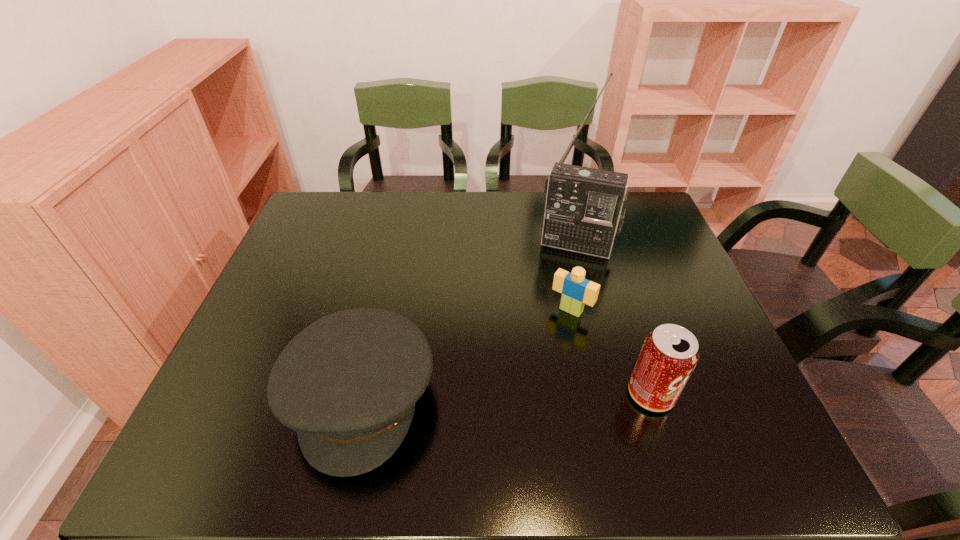
The width and height of the screenshot is (960, 540). Find the location of `beret`. beret is located at coordinates (348, 383).

Image resolution: width=960 pixels, height=540 pixels. Find the location of `the second tallest object`. the second tallest object is located at coordinates (669, 354).

The width and height of the screenshot is (960, 540). Find the location of `radio receiver`. radio receiver is located at coordinates (585, 207).

You are a GUI agent. You are given a task and a screenshot of the screen. Output one action in this format:
    pyautogui.click(x=<x>, y=<y>)
    Task: Click on the tallest object
    
    Given the screenshot: What is the action you would take?
    pyautogui.click(x=585, y=207)

Locate an element on the screen. the third nearest object is located at coordinates (577, 291).

The image size is (960, 540). I want to click on vacant position located on the left of the second tallest object, so click(595, 394).

This screenshot has width=960, height=540. Find the location of `blank space located on the display of the radio receiver`. blank space located on the display of the radio receiver is located at coordinates (550, 318).

Locate an element on the screen. This screenshot has width=960, height=540. vacant space located on the display of the radio receiver is located at coordinates (540, 355).

This screenshot has height=540, width=960. I want to click on vacant region located 0.130m on the display of the radio receiver, so click(x=560, y=288).

Where is `free region located on the face of the Lego`? This screenshot has height=540, width=960. free region located on the face of the Lego is located at coordinates (491, 418).